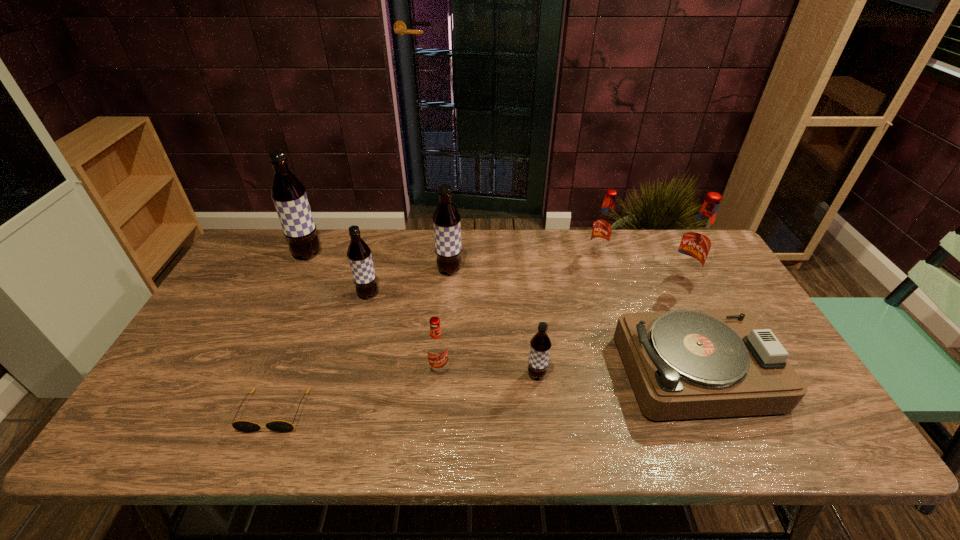
Locate an element on the screen. the leftmost red root beer is located at coordinates (437, 350).

What are the coordinates of `the nearest brown root beer` in the screenshot? It's located at (540, 344).

At what (x,y) coordinates should I click in order to perform the action: click on the smallest brown root beer. Please return your answer as a coordinate pair (x, y). The width and height of the screenshot is (960, 540). Looking at the image, I should click on (540, 344).

The width and height of the screenshot is (960, 540). In order to click on the second shortest object in this screenshot , I will do `click(687, 364)`.

I want to click on sunglasses, so click(242, 426).

Identify the location of black sunglasses. This screenshot has height=540, width=960. click(242, 426).

Where is `vacant region located 0.370m on the right of the biggest brown root beer`? The width and height of the screenshot is (960, 540). vacant region located 0.370m on the right of the biggest brown root beer is located at coordinates (434, 254).

The height and width of the screenshot is (540, 960). Identify the location of vacant space located on the left of the rightmost red root beer. (609, 279).

Find the location of `vacant space located on the left of the third brown root beer from left to right`. vacant space located on the left of the third brown root beer from left to right is located at coordinates (408, 270).

Locate an element on the screen. The height and width of the screenshot is (540, 960). vacant region located 0.200m on the left of the second root beer from left to right is located at coordinates (290, 294).